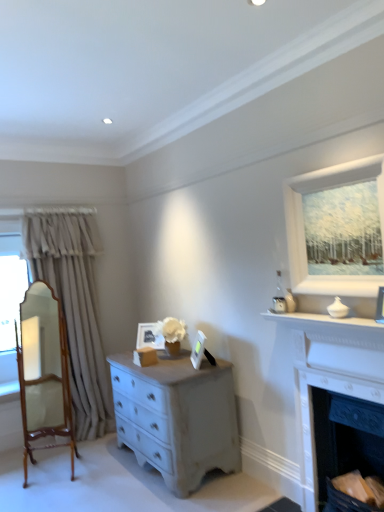
Question: Would you say beige fabric curtain at left contains dark gray stone fireplace at lower right, the 2th fireplace when ordered from top to bottom?

Choices:
 (A) yes
 (B) no

Answer: (B)

Question: Is beige fabric curtain at left located outside dark gray stone fireplace at lower right, the 2th fireplace when ordered from top to bottom?

Choices:
 (A) no
 (B) yes

Answer: (B)

Question: From the image's perspective, is beige fabric curtain at left located above dark gray stone fireplace at lower right, marked as the first fireplace in a bottom-to-top arrangement?

Choices:
 (A) yes
 (B) no

Answer: (A)

Question: Can you confirm if beige fabric curtain at left is wider than dark gray stone fireplace at lower right, the 2th fireplace when ordered from top to bottom?

Choices:
 (A) no
 (B) yes

Answer: (B)

Question: Can you confirm if beige fabric curtain at left is positioned to the left of dark gray stone fireplace at lower right, marked as the first fireplace in a bottom-to-top arrangement?

Choices:
 (A) yes
 (B) no

Answer: (A)

Question: In terms of size, does matte white picture frame at center, the third picture frame viewed from the right, appear bigger or smaller than wooden polished mirror at left?

Choices:
 (A) big
 (B) small

Answer: (B)

Question: From a real-world perspective, is matte white picture frame at center, the 3th picture frame when ordered from top to bottom, physically located above or below wooden polished mirror at left?

Choices:
 (A) above
 (B) below

Answer: (A)

Question: From their relative heights in the image, would you say matte white picture frame at center, the first picture frame in the back-to-front sequence, is taller or shorter than wooden polished mirror at left?

Choices:
 (A) tall
 (B) short

Answer: (B)

Question: Is matte white picture frame at center, acting as the first picture frame starting from the bottom, situated inside wooden polished mirror at left or outside?

Choices:
 (A) inside
 (B) outside

Answer: (B)

Question: From a real-world perspective, is beige fabric curtain at left positioned above or below white matte picture frame at upper right, which is the third picture frame from back to front?

Choices:
 (A) below
 (B) above

Answer: (A)

Question: Visually, is beige fabric curtain at left positioned to the left or to the right of white matte picture frame at upper right, which is counted as the 1th picture frame, starting from the right?

Choices:
 (A) right
 (B) left

Answer: (B)

Question: Is beige fabric curtain at left inside the boundaries of white matte picture frame at upper right, which is the third picture frame from back to front, or outside?

Choices:
 (A) inside
 (B) outside

Answer: (B)

Question: Is beige fabric curtain at left taller or shorter than white matte picture frame at upper right, which is the third picture frame from bottom to top?

Choices:
 (A) short
 (B) tall

Answer: (B)

Question: Looking at the image, does dark gray stone fireplace at lower right, marked as the first fireplace in a bottom-to-top arrangement, seem bigger or smaller compared to white matte picture frame at upper right, which is the 1th picture frame in top-to-bottom order?

Choices:
 (A) small
 (B) big

Answer: (B)

Question: Is dark gray stone fireplace at lower right, the 2th fireplace when ordered from top to bottom, to the left or to the right of white matte picture frame at upper right, which is counted as the 1th picture frame, starting from the right, in the image?

Choices:
 (A) left
 (B) right

Answer: (A)